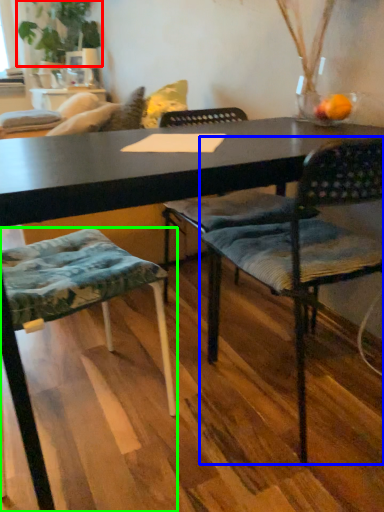
Question: Which object is the closest to the plant (highlighted by a red box)? Choose among these: chair (highlighted by a blue box) or chair (highlighted by a green box).

Choices:
 (A) chair
 (B) chair

Answer: (B)